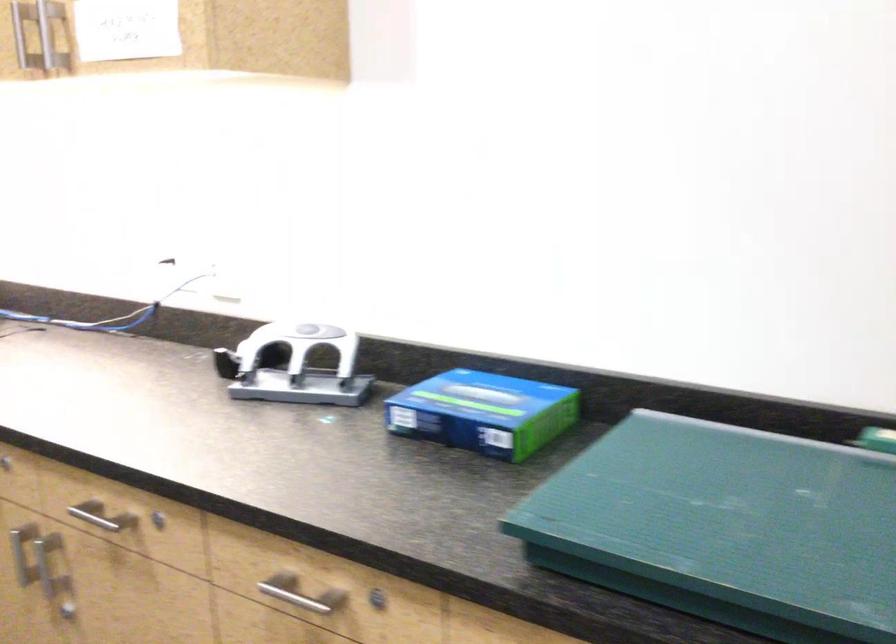
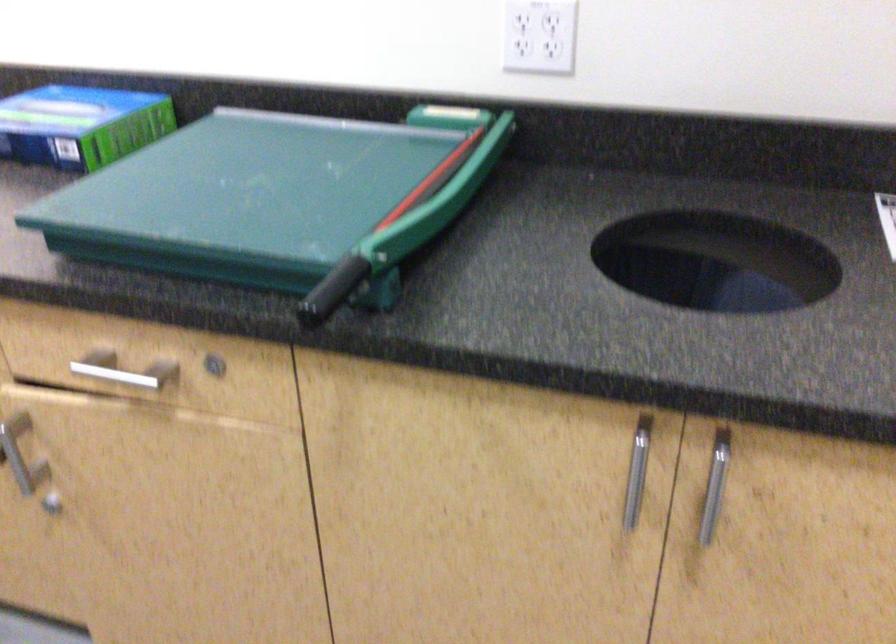
Find the pixel in the second image that matches the point at 498,410 in the first image.

(81, 125)